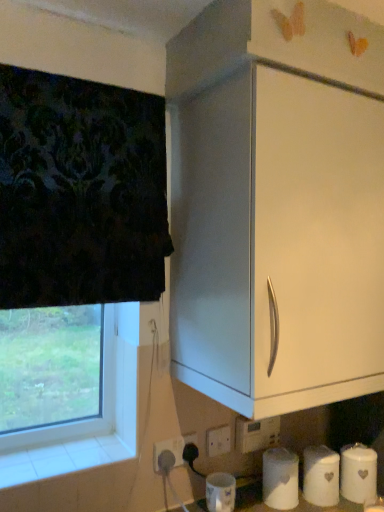
Question: From a real-world perspective, is white plastic electric outlet at lower center, the 2th electric outlet in the left-to-right sequence, positioned over white ceramic canister at lower right, acting as the 1th toilet paper starting from the right, based on gravity?

Choices:
 (A) yes
 (B) no

Answer: (A)

Question: Can you confirm if white plastic electric outlet at lower center, the 2th electric outlet in the left-to-right sequence, is shorter than white ceramic canister at lower right, acting as the 1th toilet paper starting from the right?

Choices:
 (A) yes
 (B) no

Answer: (A)

Question: Is white plastic electric outlet at lower center, the 2th electric outlet in the right-to-left sequence, directly adjacent to white ceramic canister at lower right, acting as the 1th toilet paper starting from the right?

Choices:
 (A) no
 (B) yes

Answer: (A)

Question: From a real-world perspective, is white plastic electric outlet at lower center, the 2th electric outlet in the left-to-right sequence, located beneath white ceramic canister at lower right, which is the third toilet paper from left to right?

Choices:
 (A) yes
 (B) no

Answer: (B)

Question: Is white plastic electric outlet at lower center, the 2th electric outlet in the left-to-right sequence, positioned far away from white ceramic canister at lower right, acting as the 1th toilet paper starting from the right?

Choices:
 (A) yes
 (B) no

Answer: (B)

Question: Is white plastic electric outlet at lower center, the 2th electric outlet in the right-to-left sequence, behind white ceramic canister at lower right, acting as the 1th toilet paper starting from the right?

Choices:
 (A) no
 (B) yes

Answer: (A)

Question: Is white matte cabinet at upper right taller than white matte toilet paper at lower center, the 1th toilet paper viewed from the left?

Choices:
 (A) yes
 (B) no

Answer: (A)

Question: Is white matte cabinet at upper right not within white matte toilet paper at lower center, the 1th toilet paper viewed from the left?

Choices:
 (A) yes
 (B) no

Answer: (A)

Question: Are white matte cabinet at upper right and white matte toilet paper at lower center, the 1th toilet paper viewed from the left, far apart?

Choices:
 (A) yes
 (B) no

Answer: (B)

Question: Considering the relative sizes of white matte cabinet at upper right and white matte toilet paper at lower center, the 1th toilet paper viewed from the left, in the image provided, is white matte cabinet at upper right smaller than white matte toilet paper at lower center, the 1th toilet paper viewed from the left,?

Choices:
 (A) yes
 (B) no

Answer: (B)

Question: Does white matte cabinet at upper right have a lesser height compared to white matte toilet paper at lower center, placed as the third toilet paper when sorted from right to left?

Choices:
 (A) yes
 (B) no

Answer: (B)

Question: Does white matte cabinet at upper right have a lesser width compared to white matte toilet paper at lower center, placed as the third toilet paper when sorted from right to left?

Choices:
 (A) no
 (B) yes

Answer: (A)

Question: Can you confirm if transparent glass window at lower left is bigger than white plastic electric outlet at lower center, the 3th electric outlet when ordered from right to left?

Choices:
 (A) no
 (B) yes

Answer: (B)